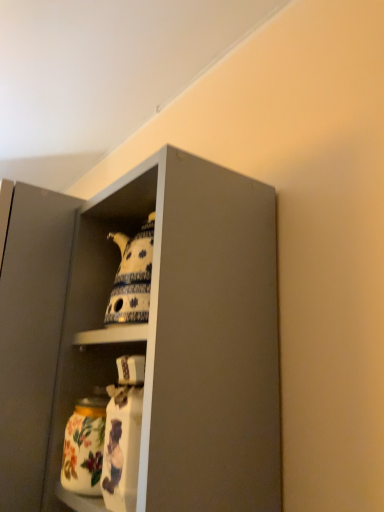
Image resolution: width=384 pixels, height=512 pixels. What do you see at coordinates (105, 259) in the screenshot? I see `porcelain teapot at upper center, which is counted as the 1th cabinet, starting from the right` at bounding box center [105, 259].

This screenshot has width=384, height=512. I want to click on floral ceramic jar at lower left, so click(79, 500).

Is porcelain teapot at upper center, which is counted as the 1th cabinet, starting from the right, inside the boundaries of porcelain teapot at upper center, which is the second cabinet in right-to-left order, or outside?

porcelain teapot at upper center, which is counted as the 1th cabinet, starting from the right, is not enclosed by porcelain teapot at upper center, which is the second cabinet in right-to-left order.

In terms of size, does porcelain teapot at upper center, which is counted as the 1th cabinet, starting from the right, appear bigger or smaller than porcelain teapot at upper center, which is the second cabinet in right-to-left order?

porcelain teapot at upper center, which is counted as the 1th cabinet, starting from the right, is smaller than porcelain teapot at upper center, which is the second cabinet in right-to-left order.

Is porcelain teapot at upper center, which is counted as the 1th cabinet, starting from the right, facing towards porcelain teapot at upper center, which is the second cabinet in right-to-left order?

No, porcelain teapot at upper center, which is counted as the 1th cabinet, starting from the right, is not oriented towards porcelain teapot at upper center, which is the second cabinet in right-to-left order.

Where is `shelf below the matte gray cabinet at upper center (from the image's perspective)`? shelf below the matte gray cabinet at upper center (from the image's perspective) is located at coordinates (79, 500).

Does point (17, 486) come behind point (65, 487)?

Yes, point (17, 486) is behind point (65, 487).

Which object is wider, matte gray cabinet at upper center or floral ceramic jar at lower left?

matte gray cabinet at upper center is wider.

Can you tell me how much matte gray cabinet at upper center and floral ceramic jar at lower left differ in facing direction?

1.49 degrees separate the facing orientations of matte gray cabinet at upper center and floral ceramic jar at lower left.

Between point (132, 509) and point (183, 191), which one is positioned in front?

The point (132, 509) is in front.

Considering the relative positions of floral ceramic jar at lower left and matte gray cabinet at upper center in the image provided, is floral ceramic jar at lower left to the left or to the right of matte gray cabinet at upper center?

Based on their positions, floral ceramic jar at lower left is located to the left of matte gray cabinet at upper center.

Is floral ceramic jar at lower left in front of or behind matte gray cabinet at upper center in the image?

In the image, floral ceramic jar at lower left appears behind matte gray cabinet at upper center.

How many degrees apart are the facing directions of floral ceramic jar at lower left and matte gray cabinet at upper center?

1.49 degrees.

Is porcelain teapot at upper center, which is the second cabinet in right-to-left order, outside of matte gray cabinet at upper center?

Yes, porcelain teapot at upper center, which is the second cabinet in right-to-left order, is located beyond the bounds of matte gray cabinet at upper center.

Is porcelain teapot at upper center, placed as the 1th cabinet when sorted from left to right, taller or shorter than matte gray cabinet at upper center?

Considering their sizes, porcelain teapot at upper center, placed as the 1th cabinet when sorted from left to right, has more height than matte gray cabinet at upper center.

Is point (121, 203) closer to camera compared to point (202, 430)?

No, it is not.

From the image's perspective, which one is positioned higher, porcelain teapot at upper center, placed as the 1th cabinet when sorted from left to right, or matte gray cabinet at upper center?

matte gray cabinet at upper center appears higher in the image.

Which is behind, point (107, 223) or point (80, 511)?

The point (107, 223) is farther.

From a real-world perspective, is porcelain teapot at upper center, which is the 2th cabinet from left to right, positioned above or below floral ceramic jar at lower left?

porcelain teapot at upper center, which is the 2th cabinet from left to right, is situated higher than floral ceramic jar at lower left in the real world.

Does porcelain teapot at upper center, which is the 2th cabinet from left to right, appear on the left side of floral ceramic jar at lower left?

No, porcelain teapot at upper center, which is the 2th cabinet from left to right, is not to the left of floral ceramic jar at lower left.

Measure the distance from matte gray cabinet at upper center to porcelain teapot at upper center, placed as the 1th cabinet when sorted from left to right.

3.39 inches.

From a real-world perspective, which object stands above the other?

matte gray cabinet at upper center is physically above.

Is matte gray cabinet at upper center aimed at porcelain teapot at upper center, placed as the 1th cabinet when sorted from left to right?

No, matte gray cabinet at upper center does not turn towards porcelain teapot at upper center, placed as the 1th cabinet when sorted from left to right.

Is the depth of matte gray cabinet at upper center less than that of porcelain teapot at upper center, which is the second cabinet in right-to-left order?

Yes, matte gray cabinet at upper center is closer to the viewer.

Are porcelain teapot at upper center, which is counted as the 1th cabinet, starting from the right, and matte gray cabinet at upper center making contact?

Yes, porcelain teapot at upper center, which is counted as the 1th cabinet, starting from the right, is next to matte gray cabinet at upper center.

Which point is more distant from viewer, [119,325] or [221,416]?

The point [119,325] is farther.

Considering the positions of objects porcelain teapot at upper center, which is the 2th cabinet from left to right, and matte gray cabinet at upper center in the image provided, who is behind, porcelain teapot at upper center, which is the 2th cabinet from left to right, or matte gray cabinet at upper center?

porcelain teapot at upper center, which is the 2th cabinet from left to right, is behind.

Identify the location of cabinet above the matte gray cabinet at upper center (from a real-world perspective). (105, 259).

Find the location of `cabinet lying above the porcelain teapot at upper center, placed as the 1th cabinet when sorted from left to right (from the image's perspective)`. cabinet lying above the porcelain teapot at upper center, placed as the 1th cabinet when sorted from left to right (from the image's perspective) is located at coordinates (105, 259).

Identify the location of cabinetry that is on the right side of floral ceramic jar at lower left. (147, 334).

From the image, which object appears to be nearer to porcelain teapot at upper center, which is counted as the 1th cabinet, starting from the right, floral ceramic jar at lower left or matte gray cabinet at upper center?

Among the two, matte gray cabinet at upper center is located nearer to porcelain teapot at upper center, which is counted as the 1th cabinet, starting from the right.

When comparing their distances from floral ceramic jar at lower left, does matte gray cabinet at upper center or porcelain teapot at upper center, which is counted as the 1th cabinet, starting from the right, seem closer?

Among the two, matte gray cabinet at upper center is located nearer to floral ceramic jar at lower left.

Estimate the real-world distances between objects in this image. Which object is closer to matte gray cabinet at upper center, floral ceramic jar at lower left or porcelain teapot at upper center, which is the second cabinet in right-to-left order?

The object closer to matte gray cabinet at upper center is porcelain teapot at upper center, which is the second cabinet in right-to-left order.

Which object lies nearer to the anchor point porcelain teapot at upper center, placed as the 1th cabinet when sorted from left to right, matte gray cabinet at upper center or floral ceramic jar at lower left?

matte gray cabinet at upper center.

Based on the photo, estimate the real-world distances between objects in this image. Which object is closer to floral ceramic jar at lower left, porcelain teapot at upper center, which is the 2th cabinet from left to right, or matte gray cabinet at upper center?

matte gray cabinet at upper center lies closer to floral ceramic jar at lower left than the other object.

In the scene shown: When comparing their distances from matte gray cabinet at upper center, does floral ceramic jar at lower left or porcelain teapot at upper center, which is counted as the 1th cabinet, starting from the right, seem further?

Based on the image, floral ceramic jar at lower left appears to be further to matte gray cabinet at upper center.

When comparing their distances from floral ceramic jar at lower left, does matte gray cabinet at upper center or porcelain teapot at upper center, which is the second cabinet in right-to-left order, seem further?

matte gray cabinet at upper center is further to floral ceramic jar at lower left.

Looking at the image, which one is located further to floral ceramic jar at lower left, porcelain teapot at upper center, which is the second cabinet in right-to-left order, or matte gray cabinet at upper center?

matte gray cabinet at upper center is further to floral ceramic jar at lower left.

Find the location of a particular element. cabinetry between porcelain teapot at upper center, which is the 2th cabinet from left to right, and floral ceramic jar at lower left vertically is located at coordinates (147, 334).

Locate an element on the screen. The width and height of the screenshot is (384, 512). shelf between porcelain teapot at upper center, placed as the 1th cabinet when sorted from left to right, and porcelain teapot at upper center, which is the 2th cabinet from left to right, in the horizontal direction is located at coordinates (79, 500).

Locate an element on the screen. cabinet situated between porcelain teapot at upper center, placed as the 1th cabinet when sorted from left to right, and matte gray cabinet at upper center from left to right is located at coordinates (105, 259).

Locate an element on the screen. This screenshot has height=512, width=384. shelf between porcelain teapot at upper center, placed as the 1th cabinet when sorted from left to right, and matte gray cabinet at upper center from left to right is located at coordinates (79, 500).